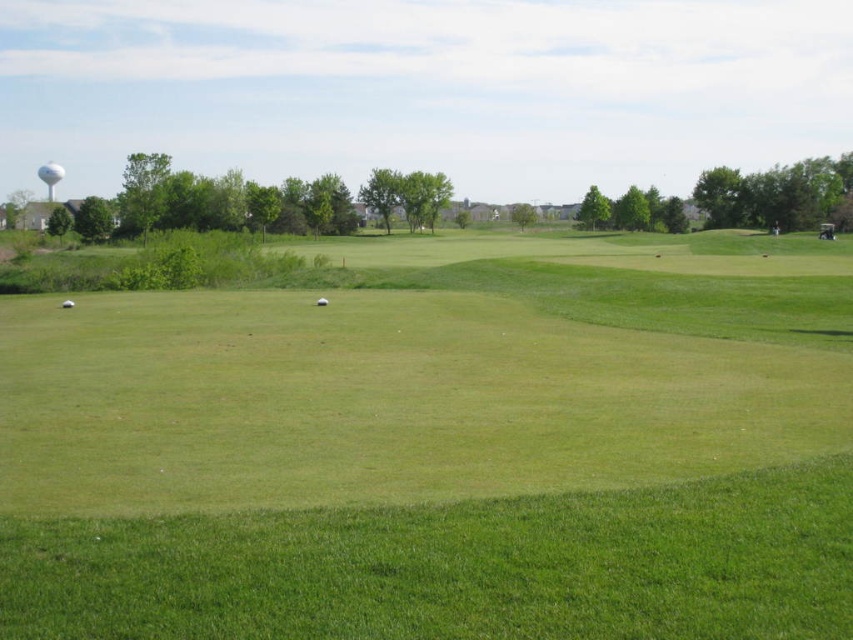
Question: Can you confirm if green grassy field at center is bigger than white matte golf ball at lower left?

Choices:
 (A) no
 (B) yes

Answer: (B)

Question: Does green grassy field at center have a greater width compared to white matte golf ball at lower left?

Choices:
 (A) no
 (B) yes

Answer: (B)

Question: Among these points, which one is farthest from the camera?

Choices:
 (A) (379, 266)
 (B) (73, 301)
 (C) (323, 305)

Answer: (A)

Question: Can you confirm if green grassy field at center is positioned to the right of white matte golf ball at lower left?

Choices:
 (A) no
 (B) yes

Answer: (B)

Question: Among these points, which one is farthest from the camera?

Choices:
 (A) (782, 387)
 (B) (67, 301)
 (C) (320, 304)

Answer: (B)

Question: Which point appears closest to the camera in this image?

Choices:
 (A) (318, 304)
 (B) (65, 301)

Answer: (A)